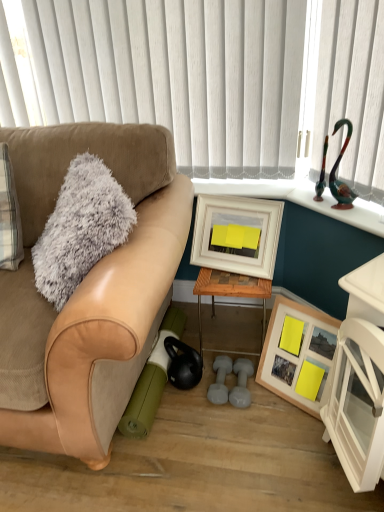
Describe the element at coordinates (81, 228) in the screenshot. I see `fuzzy gray throw pillow at left` at that location.

In the scene shown: In order to face fuzzy gray throw pillow at left, should I rotate leftwards or rightwards?

It's best to rotate left around 14.797 degrees.

Where is `woodenmaterial/texturetable at center`? The image size is (384, 512). woodenmaterial/texturetable at center is located at coordinates (230, 291).

The width and height of the screenshot is (384, 512). Describe the element at coordinates (230, 291) in the screenshot. I see `woodenmaterial/texturetable at center` at that location.

What do you see at coordinates (297, 352) in the screenshot? The width and height of the screenshot is (384, 512). I see `wooden framed picture at lower right, which appears as the second picture frame when viewed from the top` at bounding box center [297, 352].

Find the location of `suede tan couch at left`. suede tan couch at left is located at coordinates (97, 285).

Between fuzzy gray throw pillow at left and white vertical blinds at upper center, which one is positioned behind?

white vertical blinds at upper center.

Is fuzzy gray throw pillow at left inside or outside of white vertical blinds at upper center?

fuzzy gray throw pillow at left is located beyond the bounds of white vertical blinds at upper center.

Considering the positions of point (61, 275) and point (230, 145), is point (61, 275) closer or farther from the camera than point (230, 145)?

Clearly, point (61, 275) is closer to the camera than point (230, 145).

Looking at this image, how much distance is there between fuzzy gray throw pillow at left and white vertical blinds at upper center?

A distance of 26.04 inches exists between fuzzy gray throw pillow at left and white vertical blinds at upper center.

Who is taller, suede tan couch at left or wooden framed picture at lower right, acting as the first picture frame starting from the bottom?

With more height is suede tan couch at left.

Between suede tan couch at left and wooden framed picture at lower right, which appears as the second picture frame when viewed from the top, which one appears on the left side from the viewer's perspective?

From the viewer's perspective, suede tan couch at left appears more on the left side.

Which of these two, suede tan couch at left or wooden framed picture at lower right, which appears as the second picture frame when viewed from the top, is thinner?

With smaller width is wooden framed picture at lower right, which appears as the second picture frame when viewed from the top.

Is the depth of suede tan couch at left less than that of wooden framed picture at lower right, which appears as the second picture frame when viewed from the top?

Yes.

The height and width of the screenshot is (512, 384). What are the coordinates of `studio couch in front of the white vertical blinds at upper center` in the screenshot? It's located at (97, 285).

Which of these two, white vertical blinds at upper center or suede tan couch at left, is smaller?

With smaller size is white vertical blinds at upper center.

Is suede tan couch at left at the back of white vertical blinds at upper center?

No, white vertical blinds at upper center's orientation is not away from suede tan couch at left.

Is suede tan couch at left positioned in front of woodenmaterial/texturetable at center?

Yes, suede tan couch at left is closer to the camera.

Is suede tan couch at left to the right of woodenmaterial/texturetable at center from the viewer's perspective?

No.

Do you think suede tan couch at left is within woodenmaterial/texturetable at center, or outside of it?

suede tan couch at left lies outside woodenmaterial/texturetable at center.

Is wooden framed picture at lower right, acting as the first picture frame starting from the bottom, wider or thinner than woodenmaterial/texturetable at center?

In the image, wooden framed picture at lower right, acting as the first picture frame starting from the bottom, appears to be more narrow than woodenmaterial/texturetable at center.

Is point (297, 334) positioned after point (206, 268)?

That is False.

Is wooden framed picture at lower right, acting as the first picture frame starting from the bottom, completely or partially outside of woodenmaterial/texturetable at center?

wooden framed picture at lower right, acting as the first picture frame starting from the bottom, is positioned outside woodenmaterial/texturetable at center.

From the image's perspective, would you say wooden framed picture at lower right, which appears as the second picture frame when viewed from the top, is positioned over woodenmaterial/texturetable at center?

No.

Which is farther, (286,362) or (24,220)?

The point (24,220) is farther.

From a real-world perspective, between wooden framed picture at lower right, which appears as the second picture frame when viewed from the top, and suede tan couch at left, who is vertically higher?

From a 3D spatial view, suede tan couch at left is above.

Between wooden framed picture at lower right, which appears as the second picture frame when viewed from the top, and suede tan couch at left, which one appears on the left side from the viewer's perspective?

From the viewer's perspective, suede tan couch at left appears more on the left side.

Is the surface of wooden framed picture at lower right, which appears as the second picture frame when viewed from the top, in direct contact with suede tan couch at left?

No, wooden framed picture at lower right, which appears as the second picture frame when viewed from the top, is not with suede tan couch at left.

From the image's perspective, who appears lower, wooden framed picture at lower right, which appears as the second picture frame when viewed from the top, or white vertical blinds at upper center?

wooden framed picture at lower right, which appears as the second picture frame when viewed from the top, from the image's perspective.

Is wooden framed picture at lower right, which appears as the second picture frame when viewed from the top, oriented away from white vertical blinds at upper center?

That's not correct — wooden framed picture at lower right, which appears as the second picture frame when viewed from the top, is not looking away from white vertical blinds at upper center.

Which object is further away from the camera taking this photo, wooden framed picture at lower right, which appears as the second picture frame when viewed from the top, or white vertical blinds at upper center?

white vertical blinds at upper center is further away from the camera.

How distant is wooden framed picture at lower right, which appears as the second picture frame when viewed from the top, from white vertical blinds at upper center?

wooden framed picture at lower right, which appears as the second picture frame when viewed from the top, and white vertical blinds at upper center are 36.33 inches apart.

In order to click on blind behind the fuzzy gray throw pillow at left in this screenshot , I will do `click(165, 75)`.

You are a GUI agent. You are given a task and a screenshot of the screen. Output one action in this format:
    pyautogui.click(x=<x>, y=<y>)
    Task: Click on the picture frame below the suede tan couch at left (from the image's perspective)
    Image resolution: width=384 pixels, height=512 pixels.
    Given the screenshot: What is the action you would take?
    pyautogui.click(x=297, y=352)

Considering their positions, is white wooden picture frame at center, the 1th picture frame positioned from the top, positioned closer to fuzzy gray throw pillow at left than wooden framed picture at lower right, which appears as the second picture frame when viewed from the top?

white wooden picture frame at center, the 1th picture frame positioned from the top.

Estimate the real-world distances between objects in this image. Which object is closer to white wooden picture frame at center, marked as the second picture frame in a bottom-to-top arrangement, suede tan couch at left or woodenmaterial/texturetable at center?

woodenmaterial/texturetable at center is positioned closer to the anchor white wooden picture frame at center, marked as the second picture frame in a bottom-to-top arrangement.

Estimate the real-world distances between objects in this image. Which object is closer to woodenmaterial/texturetable at center, white wooden picture frame at center, the 1th picture frame positioned from the top, or wooden framed picture at lower right, acting as the first picture frame starting from the bottom?

A: white wooden picture frame at center, the 1th picture frame positioned from the top, is positioned closer to the anchor woodenmaterial/texturetable at center.

From the image, which object appears to be nearer to woodenmaterial/texturetable at center, white vertical blinds at upper center or suede tan couch at left?

suede tan couch at left lies closer to woodenmaterial/texturetable at center than the other object.

When comparing their distances from woodenmaterial/texturetable at center, does fuzzy gray throw pillow at left or wooden framed picture at lower right, which appears as the second picture frame when viewed from the top, seem closer?

The object closer to woodenmaterial/texturetable at center is wooden framed picture at lower right, which appears as the second picture frame when viewed from the top.

From the image, which object appears to be nearer to white wooden picture frame at center, marked as the second picture frame in a bottom-to-top arrangement, white vertical blinds at upper center or fuzzy gray throw pillow at left?

Among the two, fuzzy gray throw pillow at left is located nearer to white wooden picture frame at center, marked as the second picture frame in a bottom-to-top arrangement.

Looking at the image, which one is located further to white vertical blinds at upper center, wooden framed picture at lower right, which appears as the second picture frame when viewed from the top, or woodenmaterial/texturetable at center?

wooden framed picture at lower right, which appears as the second picture frame when viewed from the top.

Considering their positions, is white vertical blinds at upper center positioned further to woodenmaterial/texturetable at center than white wooden picture frame at center, marked as the second picture frame in a bottom-to-top arrangement?

white vertical blinds at upper center is further to woodenmaterial/texturetable at center.

Find the location of `picture frame situated between suede tan couch at left and wooden framed picture at lower right, which appears as the second picture frame when viewed from the top, from left to right`. picture frame situated between suede tan couch at left and wooden framed picture at lower right, which appears as the second picture frame when viewed from the top, from left to right is located at coordinates coord(237,234).

Image resolution: width=384 pixels, height=512 pixels. Identify the location of throw pillow located between suede tan couch at left and wooden framed picture at lower right, acting as the first picture frame starting from the bottom, in the left-right direction. (81, 228).

The image size is (384, 512). In order to click on picture frame between fuzzy gray throw pillow at left and woodenmaterial/texturetable at center from left to right in this screenshot , I will do `click(237, 234)`.

Where is `throw pillow that lies between white vertical blinds at upper center and white wooden picture frame at center, the 1th picture frame positioned from the top, from top to bottom`? This screenshot has width=384, height=512. throw pillow that lies between white vertical blinds at upper center and white wooden picture frame at center, the 1th picture frame positioned from the top, from top to bottom is located at coordinates tap(81, 228).